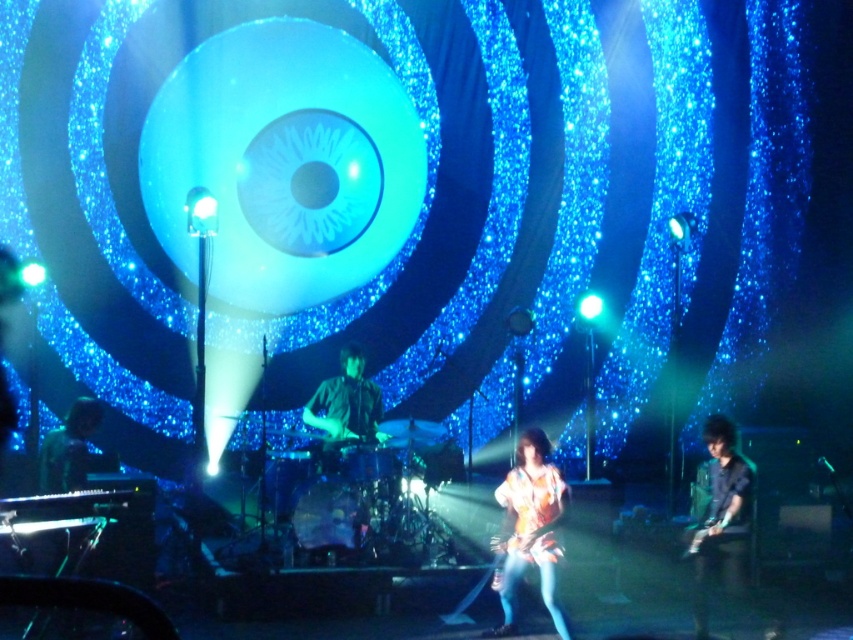
You are a photographer standing at the front of the stage. You notice two points marked in the image. The first point is at coordinate point (335, 458) and the second is at coordinate point (44, 461). Which point is closer to your camera lens?

Point (335, 458) is further to the camera than point (44, 461), so the second point at (44, 461) is closer to the camera lens.